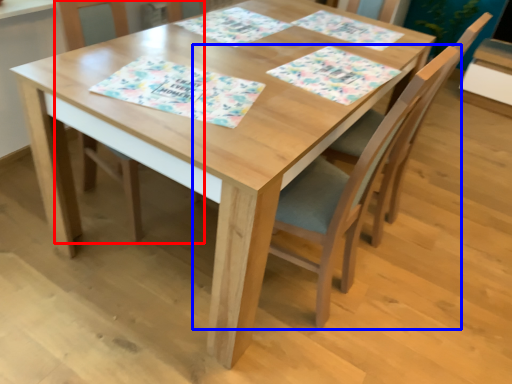
Question: Which point is further to the camera, chair (highlighted by a red box) or chair (highlighted by a blue box)?

Choices:
 (A) chair
 (B) chair

Answer: (A)